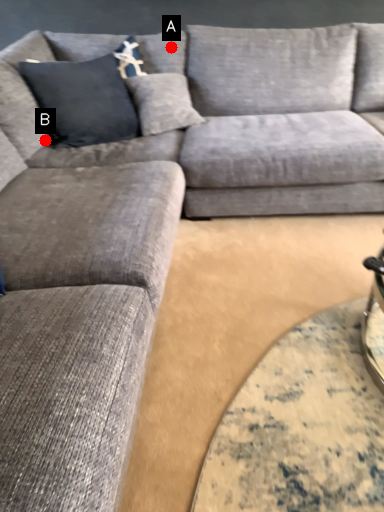
Question: Two points are circled on the image, labeled by A and B beside each circle. Which point appears farthest from the camera in this image?

Choices:
 (A) A is further
 (B) B is further

Answer: (A)